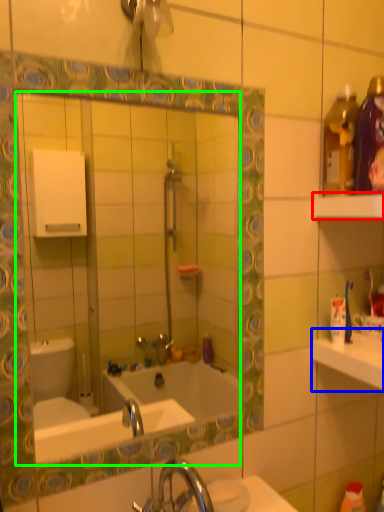
Question: Which object is positioned farthest from shelf (highlighted by a red box)? Select from counter top (highlighted by a blue box) and mirror (highlighted by a green box).

Choices:
 (A) counter top
 (B) mirror

Answer: (B)